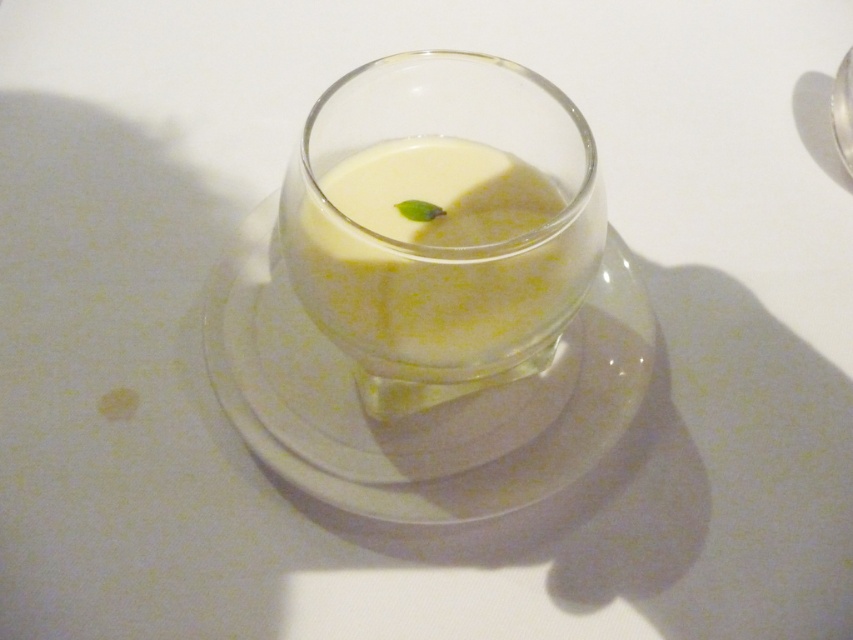
Question: Which of the following is the farthest from the observer?

Choices:
 (A) white glossy plate at center
 (B) white opaque glass at center

Answer: (A)

Question: Can you confirm if white glossy plate at center is wider than white opaque glass at center?

Choices:
 (A) no
 (B) yes

Answer: (B)

Question: Can you confirm if white glossy plate at center is positioned to the right of white opaque glass at center?

Choices:
 (A) no
 (B) yes

Answer: (A)

Question: Which object appears closest to the camera in this image?

Choices:
 (A) white opaque glass at center
 (B) white glossy plate at center

Answer: (A)

Question: Is white glossy plate at center bigger than white opaque glass at center?

Choices:
 (A) no
 (B) yes

Answer: (B)